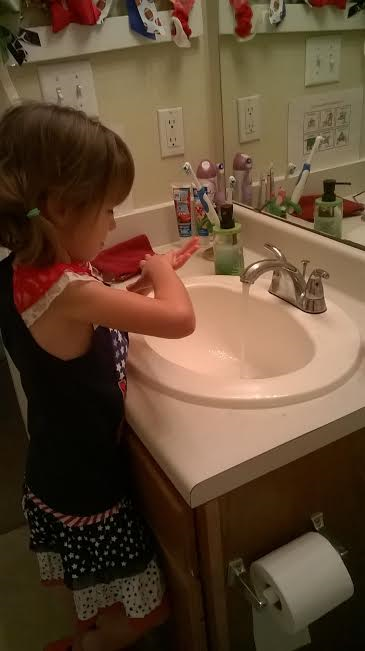
You are a GUI agent. You are given a task and a screenshot of the screen. Output one action in this format:
    pyautogui.click(x=<x>, y=<y>)
    Task: Click on the toilet roll holder
    The height and width of the screenshot is (651, 365).
    Given the screenshot: What is the action you would take?
    pyautogui.click(x=250, y=587)